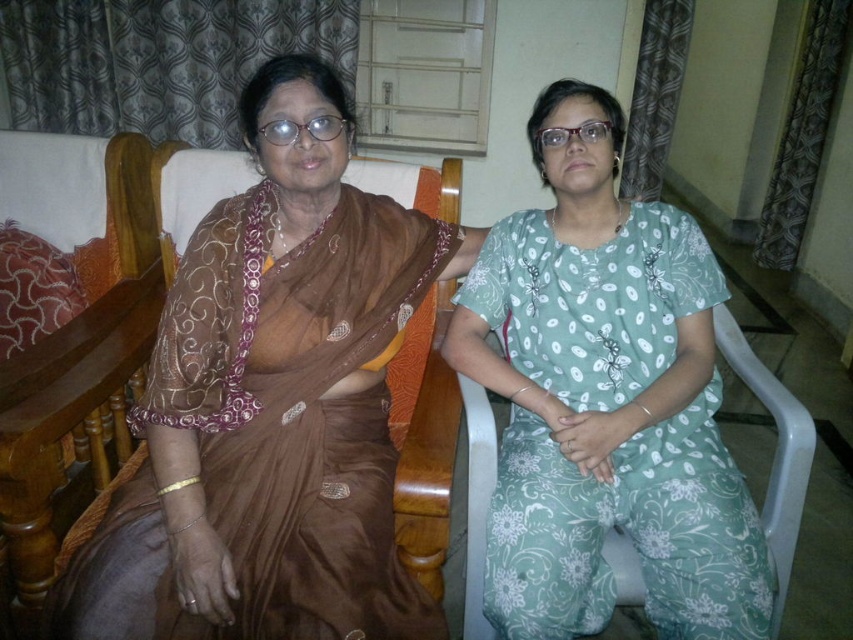
You are arranging a photo shoot and need to ensure the brown satin saree at left and the green floral dress at center are positioned correctly according to their spatial relationship. Based on the scene description, which object is located lower in the image?

The brown satin saree at left is below the green floral dress at center, so it is positioned lower in the image.

You are standing in the living room and see two points marked on the floor. The first point is at coordinates point (358, 237) and the second is at point (592, 225). Which point is closer to you?

Point (358, 237) is in front of point (592, 225), so it is closer to you.

You are organizing a fashion show and need to ensure that the brown satin saree at left and the green floral dress at center can fit side by side on a 1.5 meter wide runway. Given their sizes, will they both fit comfortably?

The brown satin saree at left is larger in size than the green floral dress at center. Since the saree is larger, it may require more space, but without specific measurements, it is uncertain if they will fit comfortably on the 1.5 meter wide runway.